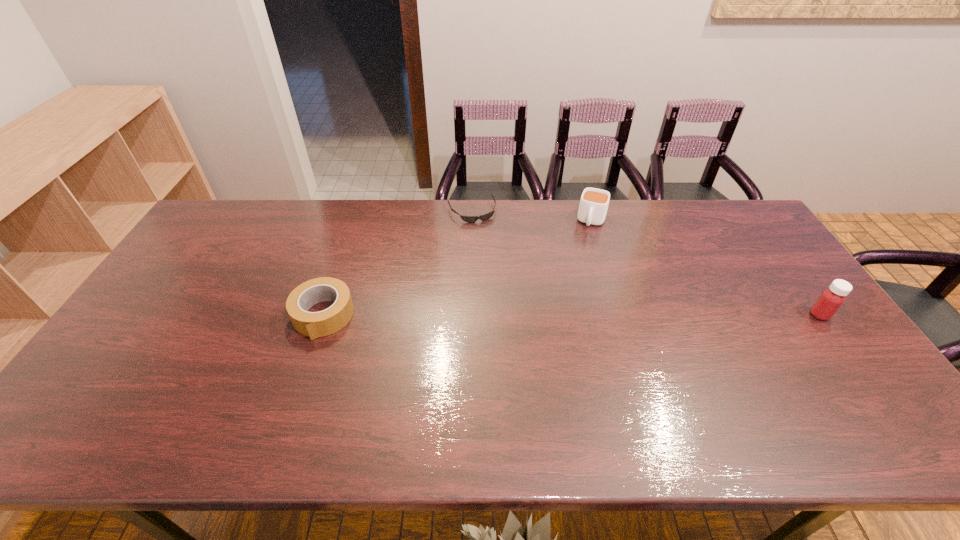
Find the location of a particular element. This screenshot has height=540, width=960. vacant space at the near edge is located at coordinates (644, 383).

Find the location of a particular element. The image size is (960, 540). free space at the right edge of the desktop is located at coordinates (804, 305).

Image resolution: width=960 pixels, height=540 pixels. I want to click on vacant space at the far left corner, so click(223, 234).

This screenshot has height=540, width=960. I want to click on free spot at the near left corner of the desktop, so [138, 401].

What are the coordinates of `vacant region at the far right corner of the desktop` in the screenshot? It's located at (697, 204).

Locate an element on the screen. free spot between the shortest object and the third shortest object is located at coordinates (532, 216).

Image resolution: width=960 pixels, height=540 pixels. In order to click on free space between the leftmost object and the third object from left to right in this screenshot , I will do `click(458, 268)`.

At what (x,y) coordinates should I click in order to perform the action: click on free space between the cup and the shortest object. Please return your answer as a coordinate pair (x, y). Looking at the image, I should click on (532, 216).

Identify the location of free space that is in between the third object from left to right and the second object from left to right. [532, 216].

The height and width of the screenshot is (540, 960). What are the coordinates of `unoccupied position between the second tallest object and the rightmost object` in the screenshot? It's located at (706, 268).